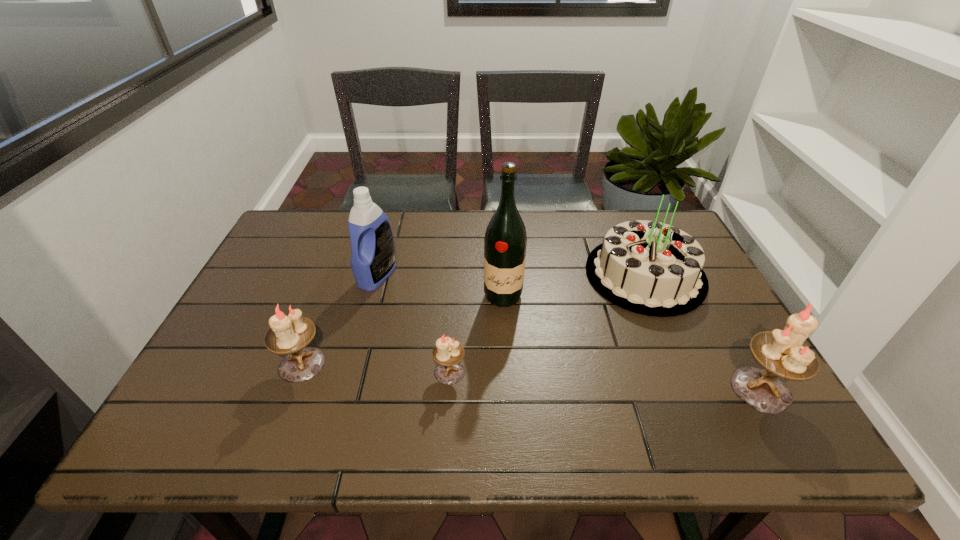
At what (x,y) coordinates should I click in order to perform the action: click on the leftmost object. Please return your answer as a coordinate pair (x, y). Looking at the image, I should click on (289, 335).

You are a GUI agent. You are given a task and a screenshot of the screen. Output one action in this format:
    pyautogui.click(x=<x>, y=<y>)
    Task: Click on the second tallest candle holder
    This screenshot has width=960, height=540.
    Given the screenshot: What is the action you would take?
    pyautogui.click(x=289, y=335)

Find the location of `the shortest candle holder`. the shortest candle holder is located at coordinates (447, 353).

Find the location of a particular element. the shortest object is located at coordinates (447, 353).

Locate an element on the screen. Image resolution: width=960 pixels, height=540 pixels. the rightmost candle holder is located at coordinates (782, 353).

At what (x,y) coordinates should I click in order to perform the action: click on birthday cake. Please return your answer as a coordinate pair (x, y). Looking at the image, I should click on (650, 268).

The image size is (960, 540). Find the location of `the tallest object`. the tallest object is located at coordinates (505, 241).

You are a GUI agent. You are given a task and a screenshot of the screen. Output one action in this format:
    pyautogui.click(x=<x>, y=<y>)
    Task: Click on the liquor
    This screenshot has height=540, width=960.
    Given the screenshot: What is the action you would take?
    [505, 241]

Find the location of a particular element. the fifth object from right to left is located at coordinates (372, 244).

Where is `free spot located 0.180m on the right of the second shortest candle holder`? This screenshot has height=540, width=960. free spot located 0.180m on the right of the second shortest candle holder is located at coordinates [x=402, y=364].